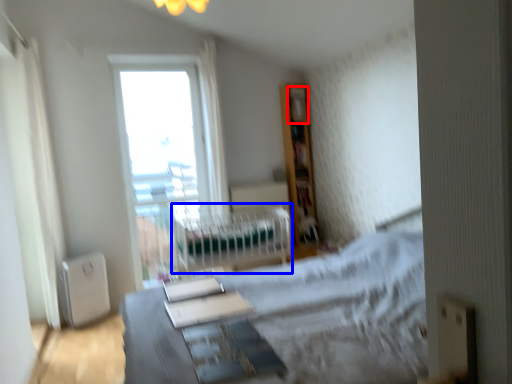
Question: Which of the following is the closest to the observer, shelf (highlighted by a red box) or hospital bed (highlighted by a blue box)?

Choices:
 (A) shelf
 (B) hospital bed

Answer: (B)